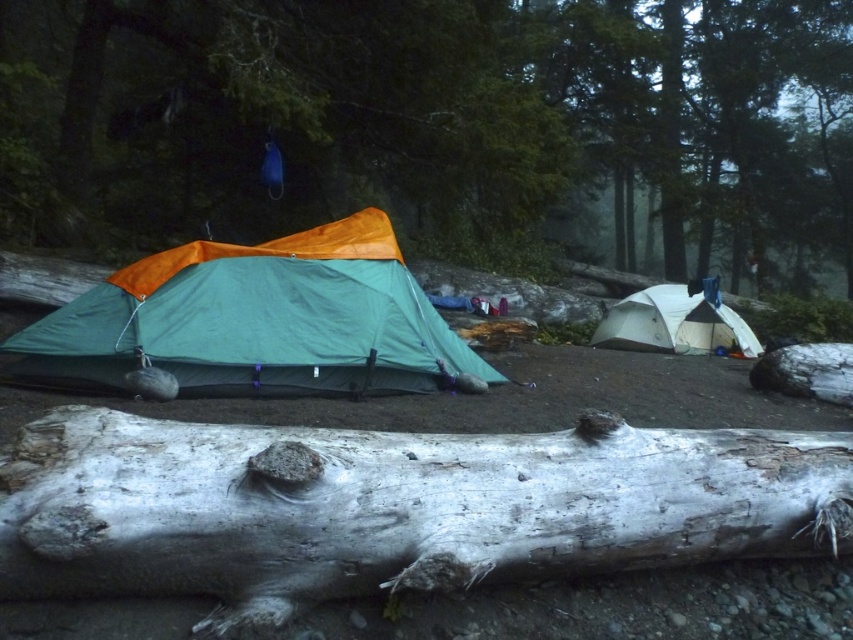
Question: Can you confirm if green fabric tent at center is bigger than white matte tent at center?

Choices:
 (A) no
 (B) yes

Answer: (B)

Question: Which point appears farthest from the camera in this image?

Choices:
 (A) (264, 38)
 (B) (802, 493)

Answer: (A)

Question: Can you confirm if white rough bark log at lower center is thinner than white matte tent at center?

Choices:
 (A) yes
 (B) no

Answer: (B)

Question: Which point is farther from the camera taking this photo?

Choices:
 (A) (727, 308)
 (B) (569, 451)

Answer: (A)

Question: Can you confirm if smooth gray log at center is positioned to the right of green fabric tent at center?

Choices:
 (A) yes
 (B) no

Answer: (A)

Question: Which object is positioned farthest from the green fabric tent at center?

Choices:
 (A) smooth gray log at center
 (B) white rough bark log at lower center

Answer: (A)